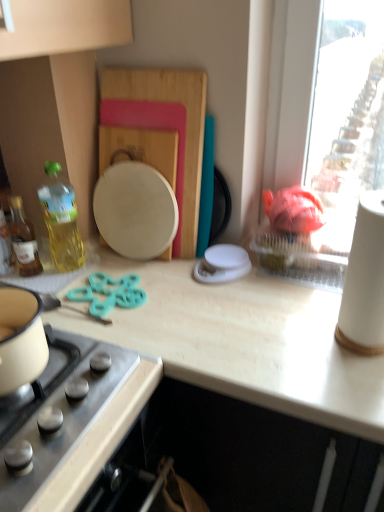
At what (x,y) coordinates should I click in order to perform the action: click on free space that is in between teal plastic scissors at center and white paper towel at right. Please return your answer as a coordinate pair (x, y). Looking at the image, I should click on (226, 321).